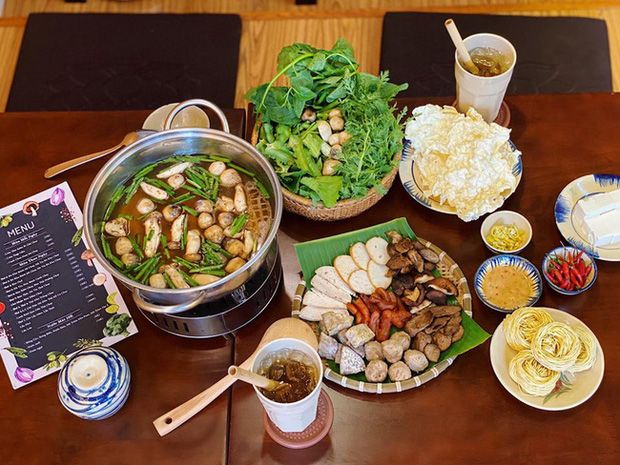
Find the location of a particular element. The width and height of the screenshot is (620, 465). spoon is located at coordinates (111, 141), (193, 409).